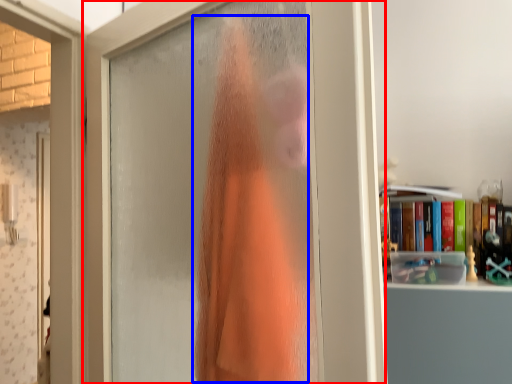
Question: Which object is closer to the camera taking this photo, door (highlighted by a red box) or clothing (highlighted by a blue box)?

Choices:
 (A) door
 (B) clothing

Answer: (A)